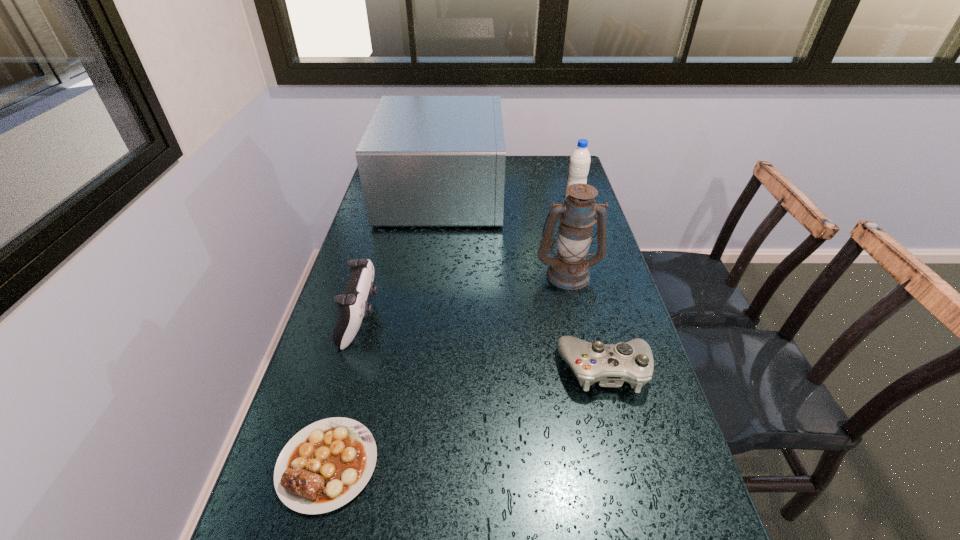
Where is `free space located with the door open on the microwave oven`? This screenshot has width=960, height=540. free space located with the door open on the microwave oven is located at coordinates (539, 193).

At what (x,y) coordinates should I click in order to perform the action: click on free space located 0.270m on the left of the third tallest object. Please return your answer as a coordinate pair (x, y). This screenshot has width=960, height=540. Looking at the image, I should click on (488, 202).

Identify the location of vacant space situated on the front-facing side of the fourth tallest object. (430, 319).

Where is `free location located 0.200m on the front of the right control`? free location located 0.200m on the front of the right control is located at coordinates (637, 494).

Locate an element on the screen. This screenshot has height=540, width=960. free space located on the back of the shortest object is located at coordinates (356, 355).

Image resolution: width=960 pixels, height=540 pixels. What are the coordinates of `object that is at the far edge` in the screenshot? It's located at (423, 160).

This screenshot has height=540, width=960. Find the location of `microwave oven at the left edge`. microwave oven at the left edge is located at coordinates (423, 160).

I want to click on control that is at the left edge, so click(x=353, y=306).

Find the location of a particular element. The image size is (960, 540). steak that is at the left edge is located at coordinates (324, 466).

The height and width of the screenshot is (540, 960). Find the location of `oil lamp at the right edge`. oil lamp at the right edge is located at coordinates (569, 270).